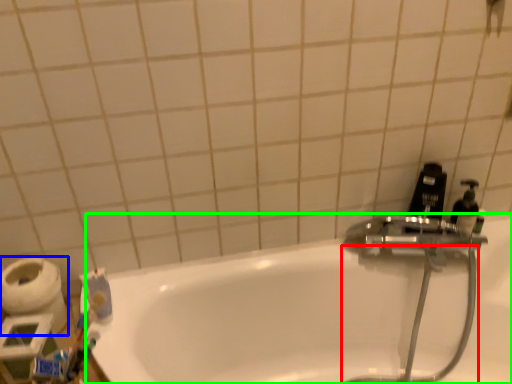
Question: Considering the real-world distances, which object is farthest from garden hose (highlighted by a red box)? toilet paper (highlighted by a blue box) or bathtub (highlighted by a green box)?

Choices:
 (A) toilet paper
 (B) bathtub

Answer: (A)